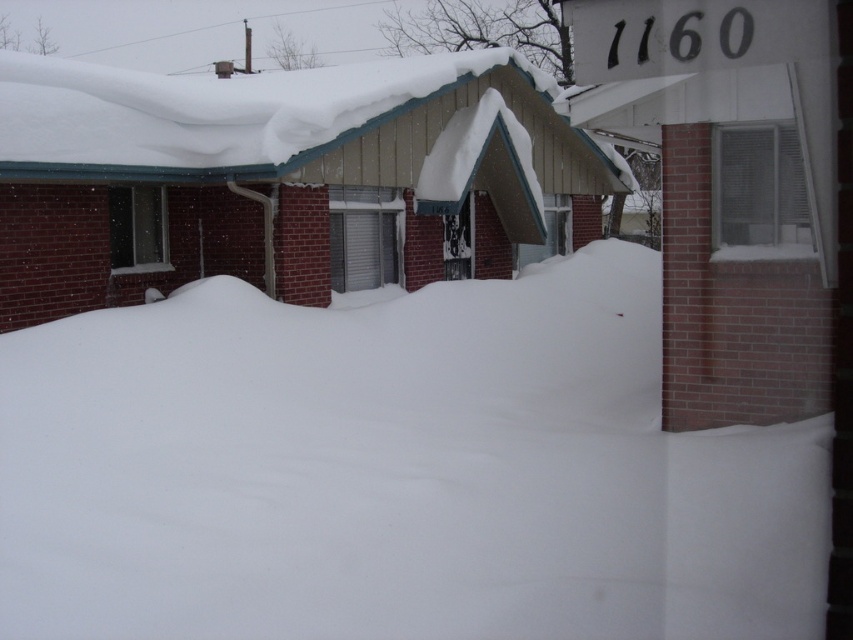
Which of these two, white fluffy snow at center or white shingled roof at upper center, stands taller?

With more height is white shingled roof at upper center.

Is point (525, 518) in front of point (622, 173)?

Yes, point (525, 518) is closer to viewer.

Does point (587, 424) come closer to viewer compared to point (33, 122)?

Yes, point (587, 424) is closer to viewer.

Identify the location of white fluffy snow at center. The height and width of the screenshot is (640, 853). (393, 472).